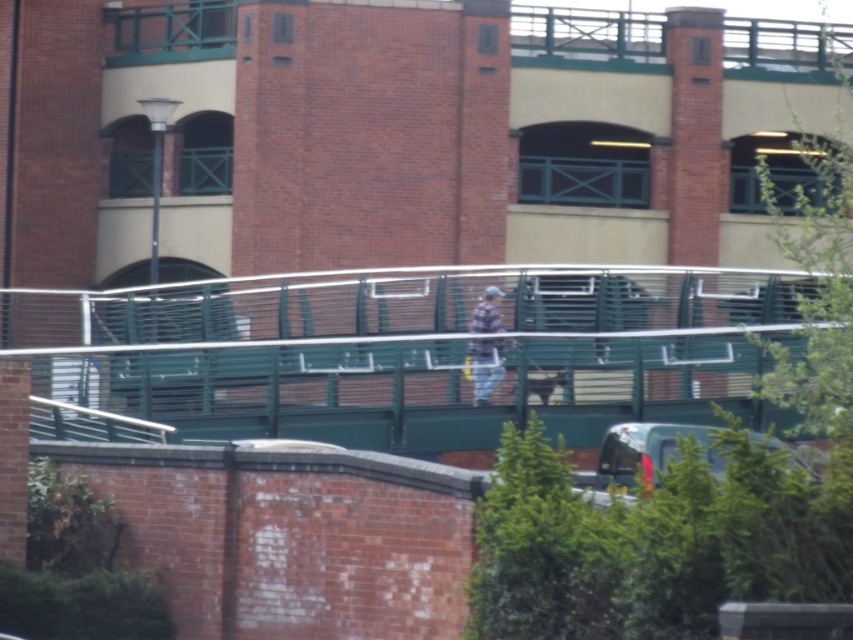
You are a delivery person standing on the ground near the green metal pedestrian bridge at center. You need to deliver a package to someone standing on the plaid fabric shirt at center. Can you directly hand over the package without moving from your current position?

The green metal pedestrian bridge at center is below the plaid fabric shirt at center, so you cannot directly hand over the package without moving because the plaid fabric shirt at center is higher up.

You are a delivery person carrying a large box that is 1.5 meters wide. You need to cross the green metal pedestrian bridge at center. Can the plaid fabric shirt at center pass through the bridge without removing the box?

The green metal pedestrian bridge at center is wider than the plaid fabric shirt at center, so the plaid fabric shirt at center can pass through the bridge without needing to remove the box as long as the shirt remains within the bridge width.